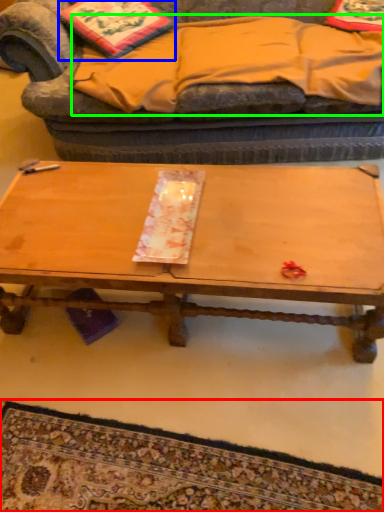
Question: Which object is the farthest from mat (highlighted by a red box)? Choose among these: pillow (highlighted by a blue box) or blanket (highlighted by a green box).

Choices:
 (A) pillow
 (B) blanket

Answer: (A)